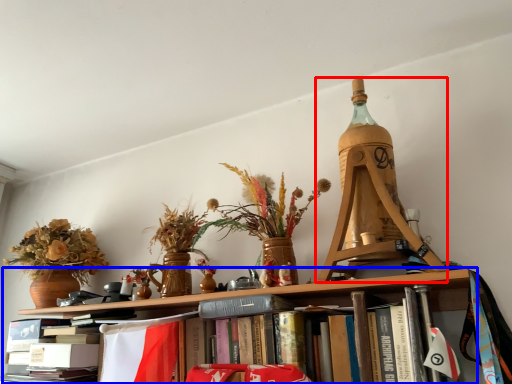
Question: Which of the following is the farthest to the observer, Eiffel tower (highlighted by a red box) or shelf (highlighted by a blue box)?

Choices:
 (A) Eiffel tower
 (B) shelf

Answer: (A)